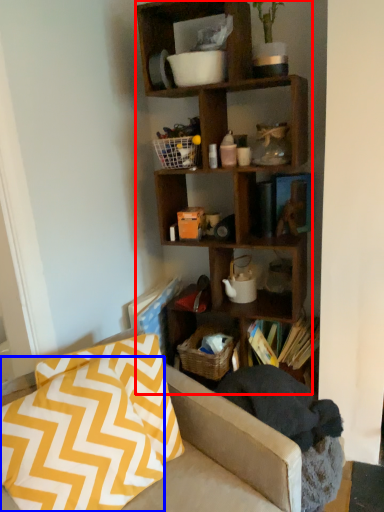
Question: Which of the following is the farthest to the observer, shelf (highlighted by a red box) or pillow (highlighted by a blue box)?

Choices:
 (A) shelf
 (B) pillow

Answer: (A)